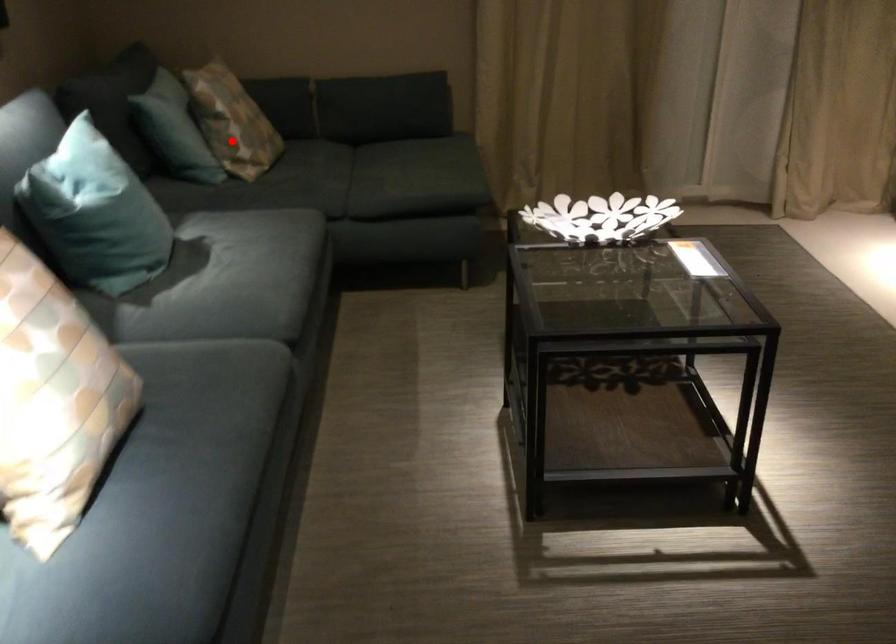
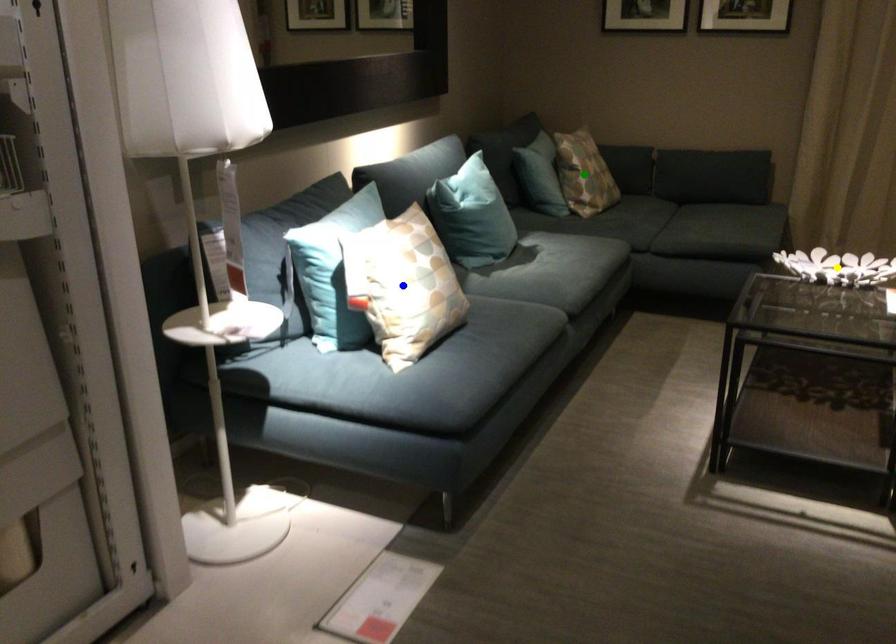
Question: I am providing you with two images of the same scene from different viewpoints. A red point is marked on the first image. You are given multiple points on the second image. Which spot in image 2 lines up with the point in image 1?

Choices:
 (A) green point
 (B) yellow point
 (C) blue point

Answer: (A)